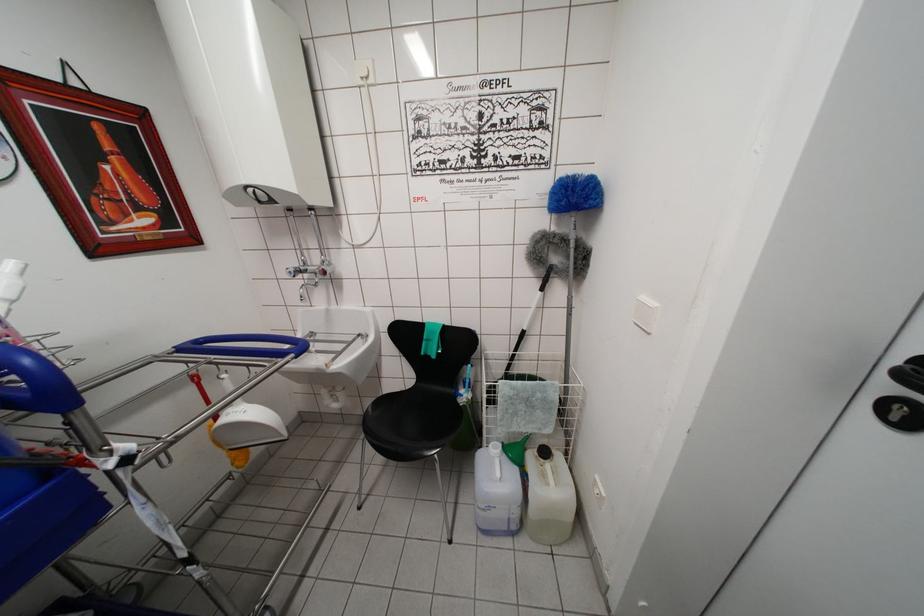
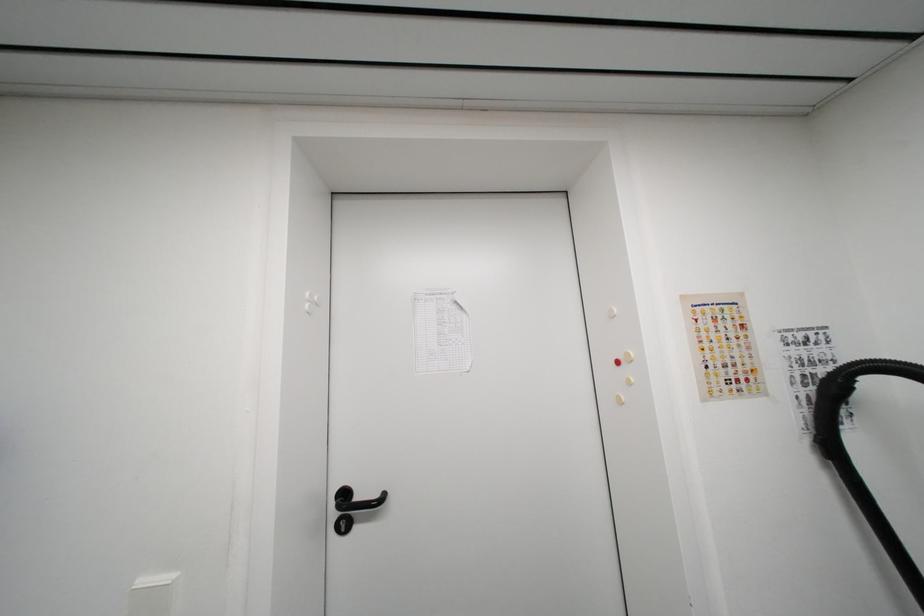
Question: How did the camera likely rotate?

Choices:
 (A) Left
 (B) Right
 (C) Up
 (D) Down

Answer: (B)